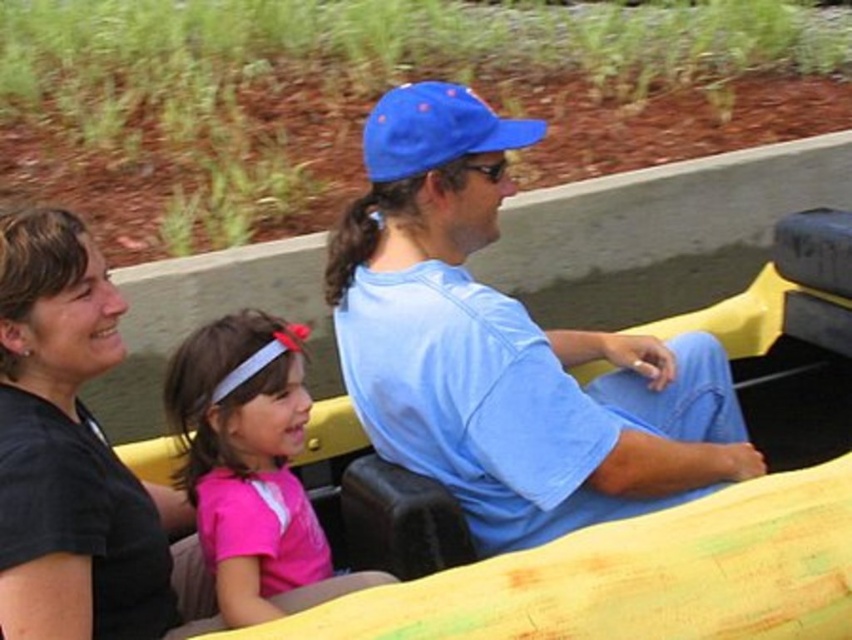
Does point (476, 209) come in front of point (364, 140)?

Yes, point (476, 209) is closer to viewer.

Is point (524, 509) positioned before point (417, 86)?

Yes, point (524, 509) is closer to viewer.

Find the location of a particular element. blue fabric cap at center is located at coordinates 504,348.

Can you confirm if black matte shirt at upper left is positioned to the left of blue fabric baseball cap at center?

Indeed, black matte shirt at upper left is positioned on the left side of blue fabric baseball cap at center.

Is point (10, 241) positioned in front of point (522, 144)?

Yes, point (10, 241) is in front of point (522, 144).

Which is behind, point (85, 637) or point (492, 148)?

The point (492, 148) is behind.

Locate an element on the screen. black matte shirt at upper left is located at coordinates (68, 451).

Identify the location of blue fabric cap at center. (504, 348).

Between blue fabric cap at center and pink matte shirt at center, which one is positioned lower?

pink matte shirt at center

Describe the element at coordinates (504, 348) in the screenshot. I see `blue fabric cap at center` at that location.

Locate an element on the screen. The image size is (852, 640). blue fabric cap at center is located at coordinates (504, 348).